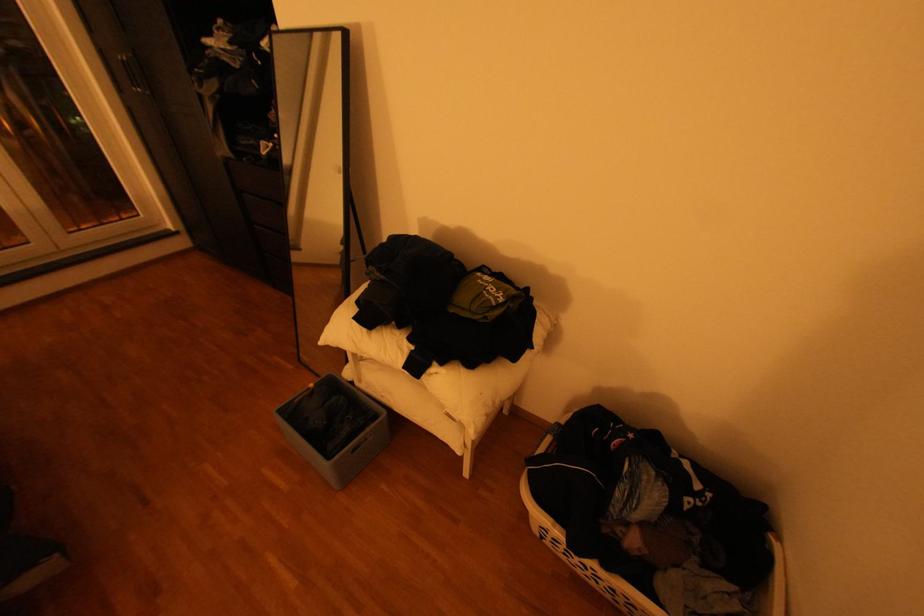
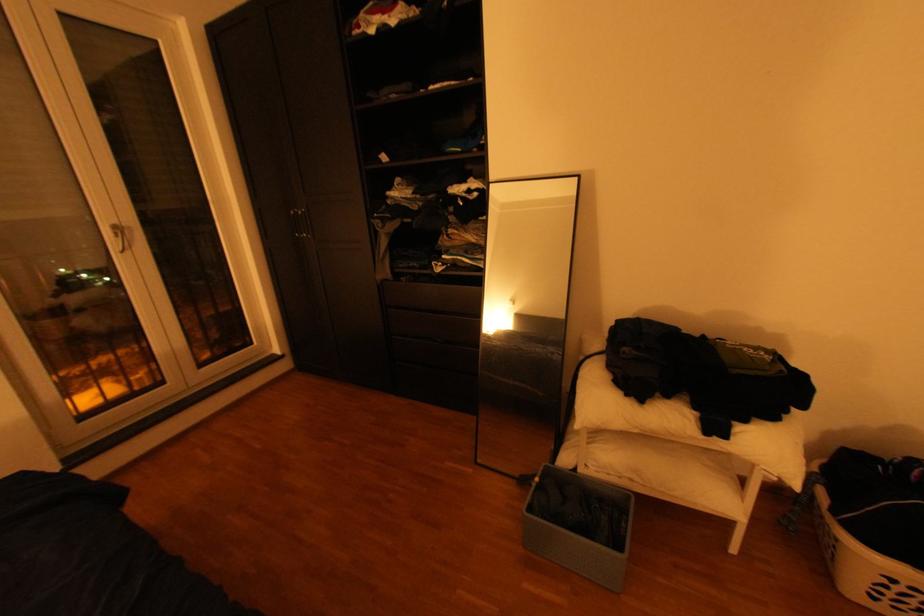
The point at (321, 385) is marked in the first image. Where is the corresponding point in the second image?

(545, 480)